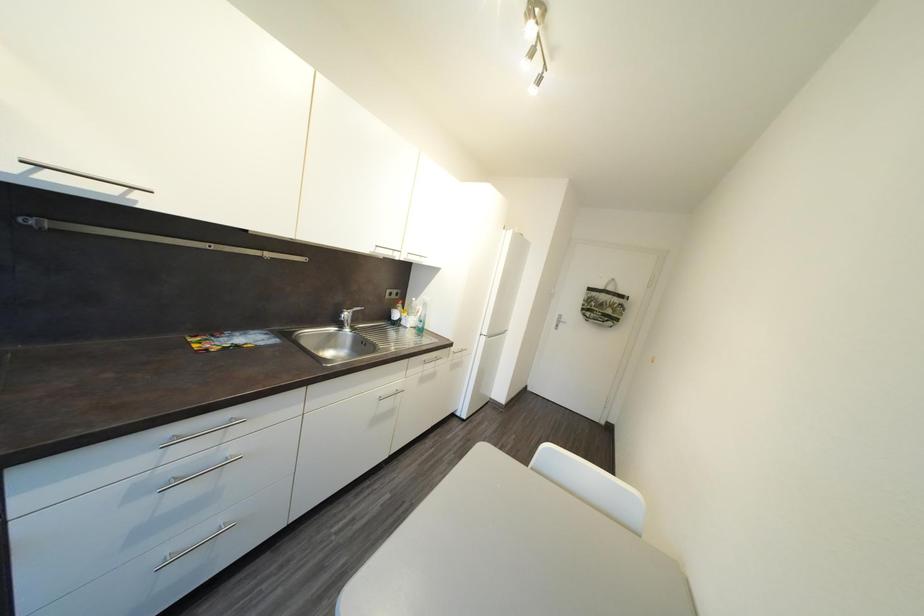
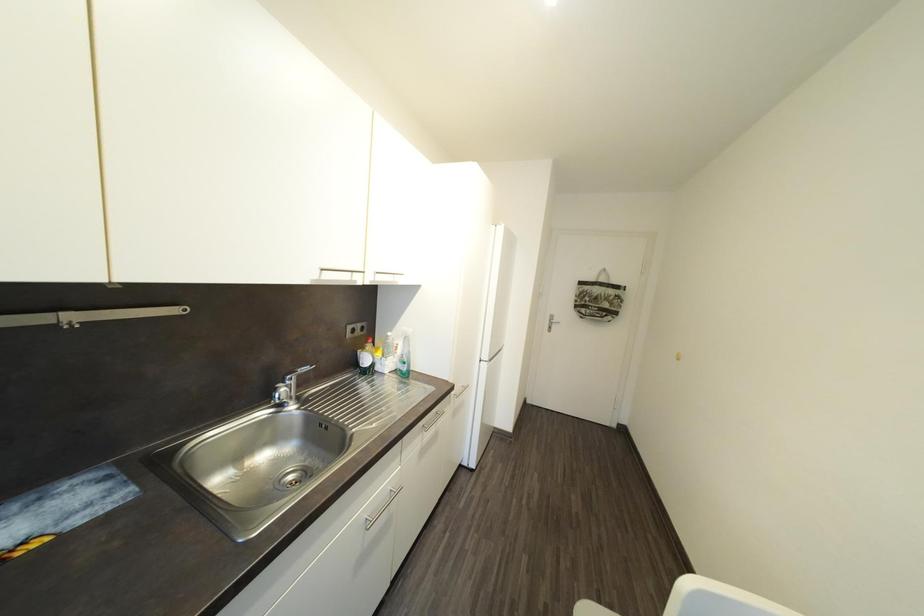
Question: How did the camera likely rotate?

Choices:
 (A) Left
 (B) Right
 (C) Up
 (D) Down

Answer: (B)